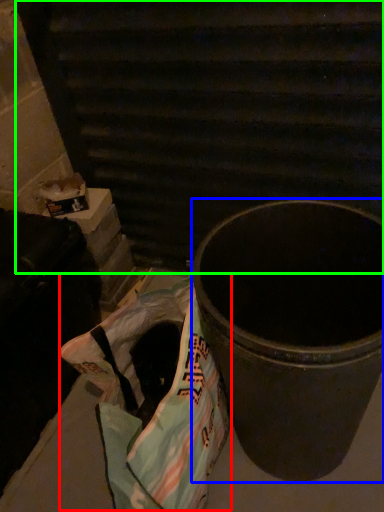
Question: Which object is the closest to the grocery bag (highlighted by a red box)? Choose among these: waste container (highlighted by a blue box) or stairwell (highlighted by a green box).

Choices:
 (A) waste container
 (B) stairwell

Answer: (A)